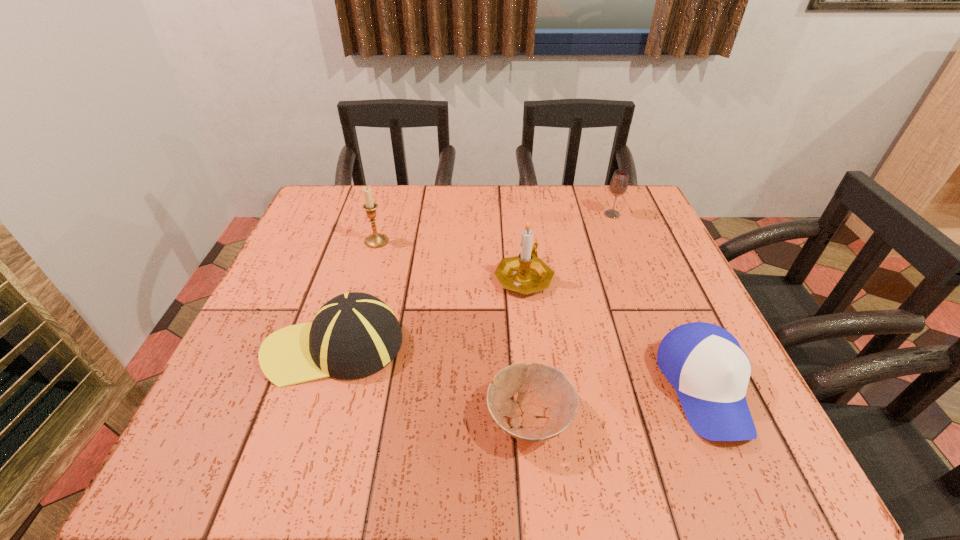
At what (x,y) coordinates should I click in order to perform the action: click on free area in between the shortest object and the left candle holder. Please return your answer as a coordinate pair (x, y). Image resolution: width=960 pixels, height=540 pixels. Looking at the image, I should click on (453, 330).

Where is `vacant space that is in between the farthest object and the nearer candle holder`? The height and width of the screenshot is (540, 960). vacant space that is in between the farthest object and the nearer candle holder is located at coordinates (567, 246).

Locate an element on the screen. This screenshot has height=540, width=960. empty space between the left baseball cap and the third farthest object is located at coordinates (429, 312).

Find the location of a particular element. This screenshot has width=960, height=540. free spot between the shortest object and the left candle holder is located at coordinates (453, 330).

You are a GUI agent. You are given a task and a screenshot of the screen. Output one action in this format:
    pyautogui.click(x=<x>, y=<y>)
    Task: Click on the vacant space in between the shortest object and the left baseball cap
    The height and width of the screenshot is (540, 960).
    Given the screenshot: What is the action you would take?
    pyautogui.click(x=432, y=382)

Point out which object is positioned as the fifth nearest to the left baseball cap. Please provide its 2D coordinates. Your answer should be formatted as a tuple, i.e. [(x, y)], where the tuple contains the x and y coordinates of a point satisfying the conditions above.

[(618, 186)]

Select which object appears as the closest to the left baseball cap. Please provide its 2D coordinates. Your answer should be formatted as a tuple, i.e. [(x, y)], where the tuple contains the x and y coordinates of a point satisfying the conditions above.

[(549, 408)]

Find the location of `vacant space that satisfies the following two spatial constraints: 1. on the front side of the nearer candle holder; 2. with the brim of the left baseball cap facing forward`. vacant space that satisfies the following two spatial constraints: 1. on the front side of the nearer candle holder; 2. with the brim of the left baseball cap facing forward is located at coordinates (531, 346).

At what (x,y) coordinates should I click in order to perform the action: click on free space that satisfies the following two spatial constraints: 1. on the back side of the right candle holder; 2. on the right side of the bowl. Please return your answer as a coordinate pair (x, y). Looking at the image, I should click on (516, 277).

Image resolution: width=960 pixels, height=540 pixels. I want to click on free spot that satisfies the following two spatial constraints: 1. on the back side of the farthest object; 2. on the right side of the fifth nearest object, so click(384, 214).